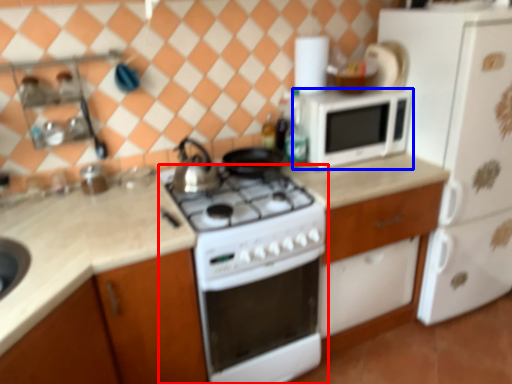
Question: Among these objects, which one is farthest to the camera, home appliance (highlighted by a red box) or microwave oven (highlighted by a blue box)?

Choices:
 (A) home appliance
 (B) microwave oven

Answer: (B)